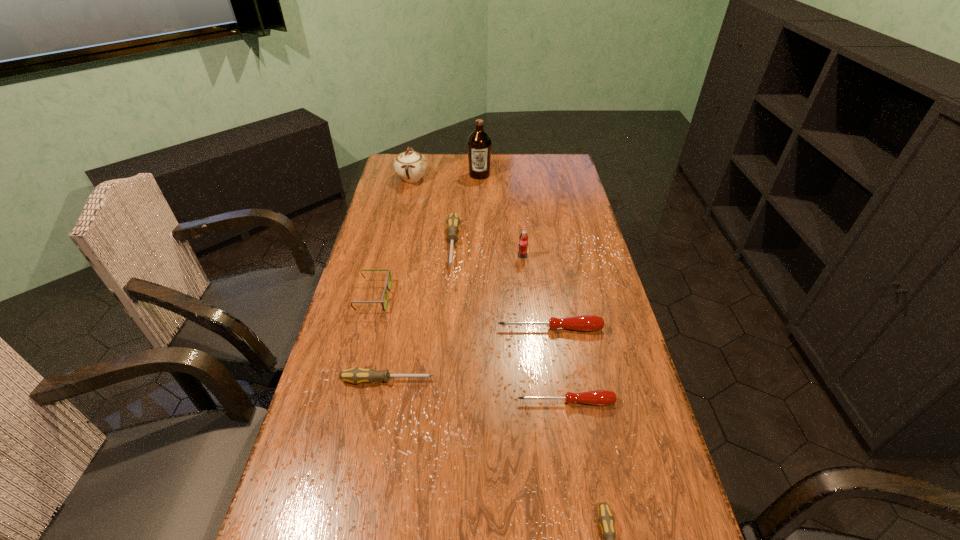
Select which gray screwdriver appears as the second closest to the second nearest gray screwdriver. Please provide its 2D coordinates. Your answer should be formatted as a tuple, i.e. [(x, y)], where the tuple contains the x and y coordinates of a point satisfying the conditions above.

[(606, 520)]

Identify which gray screwdriver is located as the nearest to the seventh farthest object. Please provide its 2D coordinates. Your answer should be formatted as a tuple, i.e. [(x, y)], where the tuple contains the x and y coordinates of a point satisfying the conditions above.

[(453, 223)]

Locate which red screwdriver is the second closest to the second nearest gray screwdriver. Please provide its 2D coordinates. Your answer should be formatted as a tuple, i.e. [(x, y)], where the tuple contains the x and y coordinates of a point satisfying the conditions above.

[(584, 322)]

Locate which red screwdriver ranks in proximity to the spectacles. Please provide its 2D coordinates. Your answer should be formatted as a tuple, i.e. [(x, y)], where the tuple contains the x and y coordinates of a point satisfying the conditions above.

[(584, 322)]

This screenshot has width=960, height=540. Identify the location of vacant point that satisfies the following two spatial constraints: 1. on the label of the fifth object from right to left; 2. on the lens of the fifth nearest object. (479, 296).

This screenshot has height=540, width=960. Identify the location of vacant space that satisfies the following two spatial constraints: 1. on the label of the olive oil; 2. on the left side of the fourth farthest screwdriver. (479, 402).

I want to click on free location that satisfies the following two spatial constraints: 1. at the tip of the farthest gray screwdriver; 2. on the lens of the fifth nearest object, so click(448, 296).

Where is `free space in the image that satisfies the following two spatial constraints: 1. on the lens of the black spectacles; 2. on the right side of the smaller red screwdriver`? free space in the image that satisfies the following two spatial constraints: 1. on the lens of the black spectacles; 2. on the right side of the smaller red screwdriver is located at coordinates (347, 402).

Identify the location of vacant space that satisfies the following two spatial constraints: 1. at the tip of the second nearest object; 2. on the left side of the second farthest gray screwdriver. The width and height of the screenshot is (960, 540). (384, 402).

The height and width of the screenshot is (540, 960). I want to click on vacant space that satisfies the following two spatial constraints: 1. on the lens of the fifth farthest object; 2. on the right side of the nearer red screwdriver, so click(347, 402).